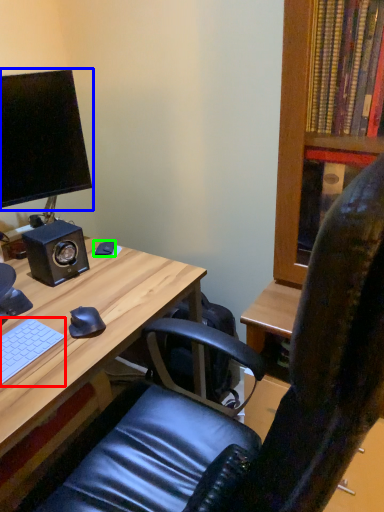
Question: Estimate the real-world distances between objects in this image. Which object is closer to computer keyboard (highlighted by a red box), computer monitor (highlighted by a blue box) or mouse (highlighted by a green box)?

Choices:
 (A) computer monitor
 (B) mouse

Answer: (B)